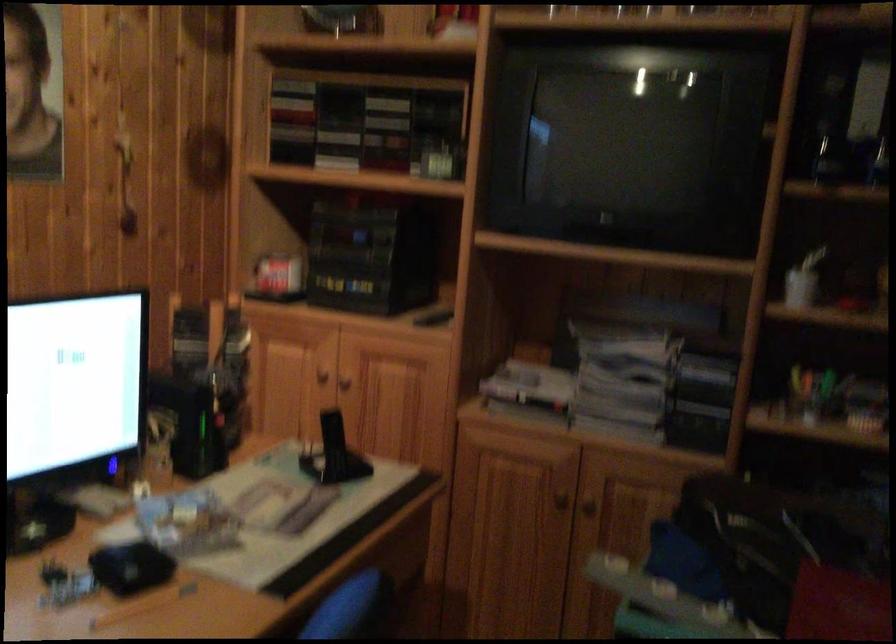
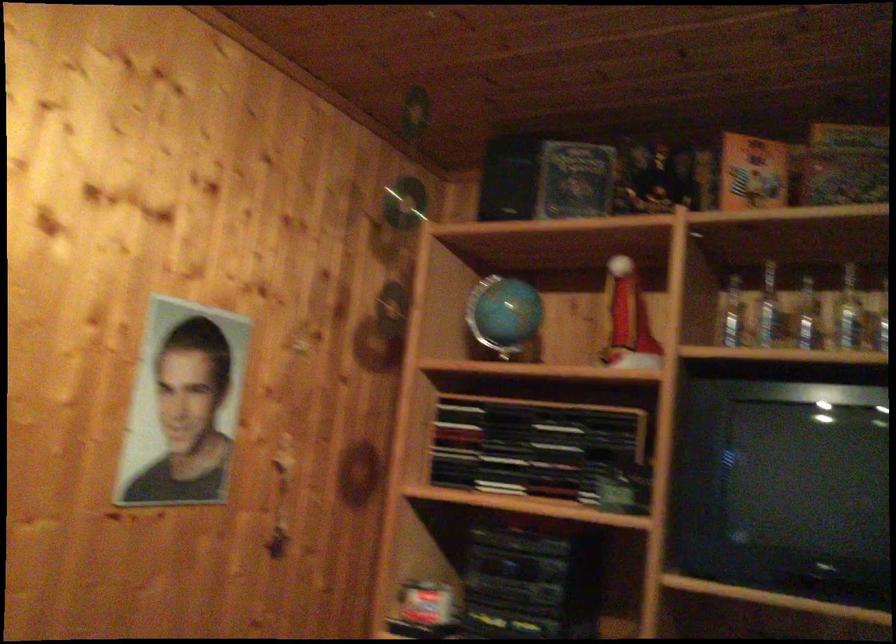
What movement of the cameraman would produce the second image?

The movement direction of the cameraman is left, forward.